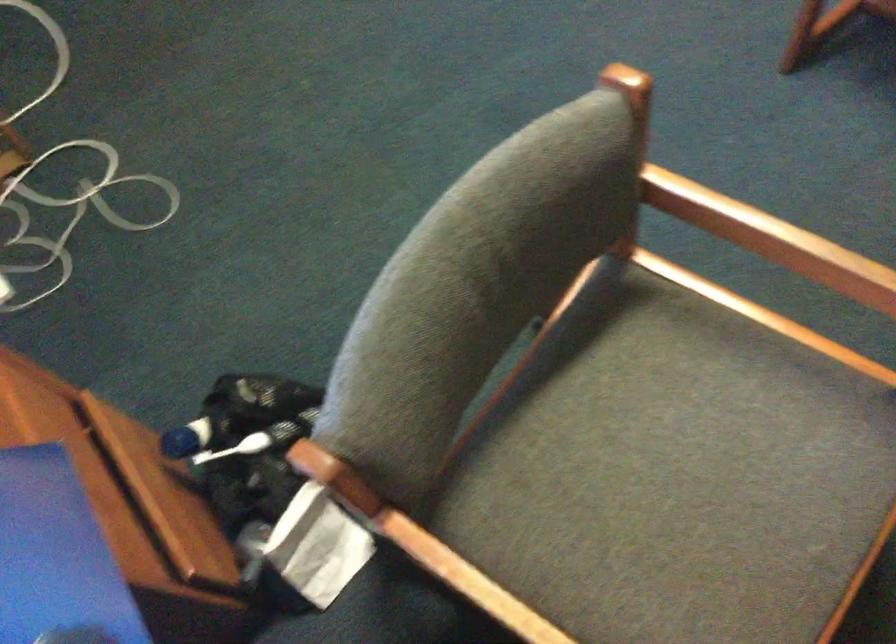
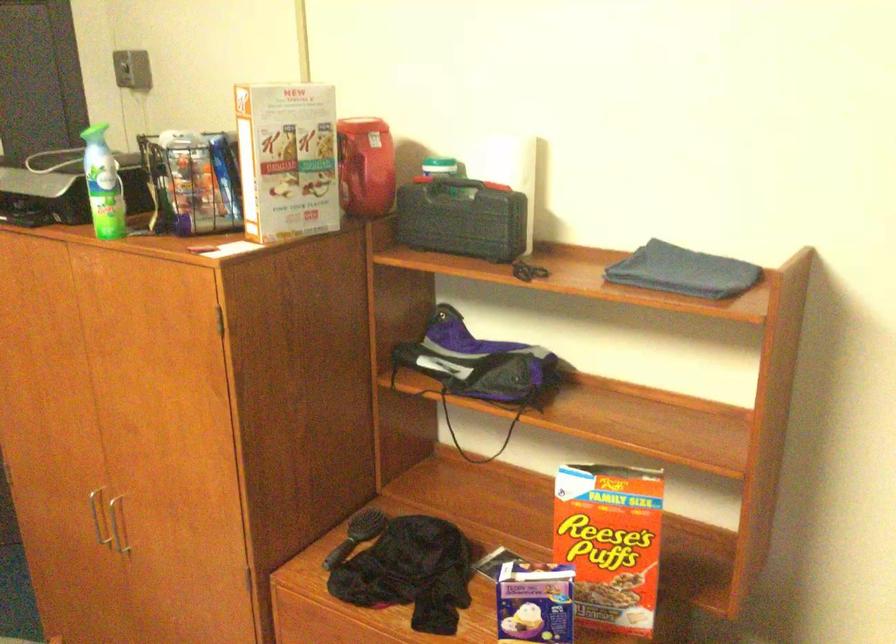
Question: The first image is from the beginning of the video and the second image is from the end. How did the camera likely rotate when shooting the video?

Choices:
 (A) Left
 (B) Right
 (C) Up
 (D) Down

Answer: (B)